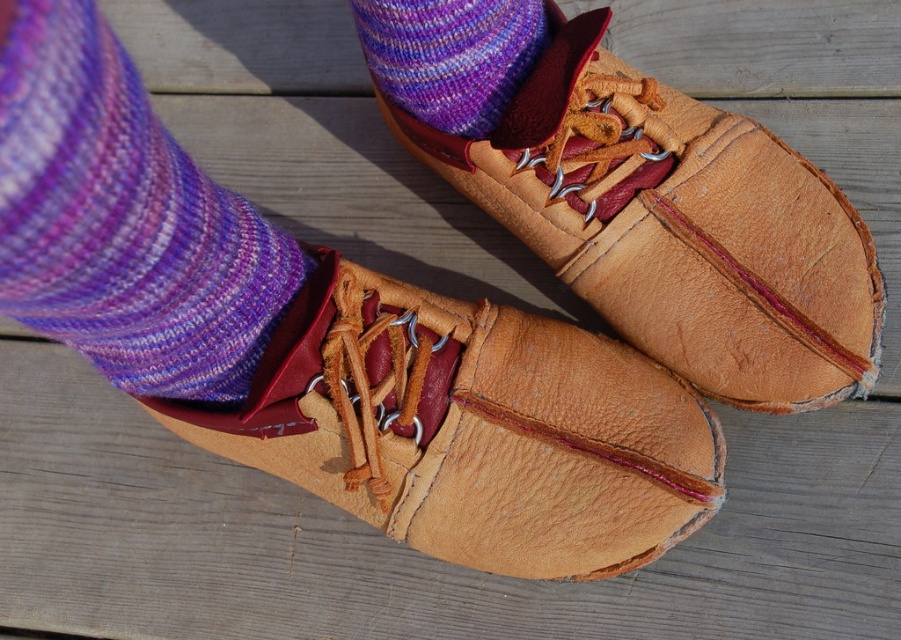
You are trying to decide which item to place in a narrow drawer. The drawer can only accommodate items that are not wider than the purple knitted sock at upper left. Based on the image, can the tan leather shoe at center fit in the drawer?

The tan leather shoe at center might be wider than purple knitted sock at upper left, so it may not fit in the drawer if the drawer can only accommodate items no wider than the purple knitted sock at upper left.

You are standing in front of the wooden planks background and want to place a small pebble between the two points, point (626, 257) and point (140, 147). Which point should you place it closer to so that it is in front of both points?

You should place the pebble closer to point (140, 147) because it is in front of point (626, 257).